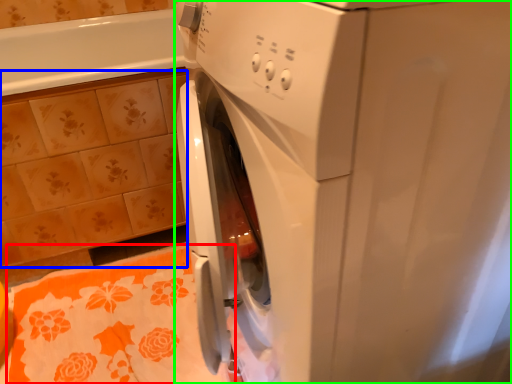
Question: Which object is positioned farthest from bath towel (highlighted by a red box)? Select from ceramic tile (highlighted by a blue box) and washing machine (highlighted by a green box).

Choices:
 (A) ceramic tile
 (B) washing machine

Answer: (B)